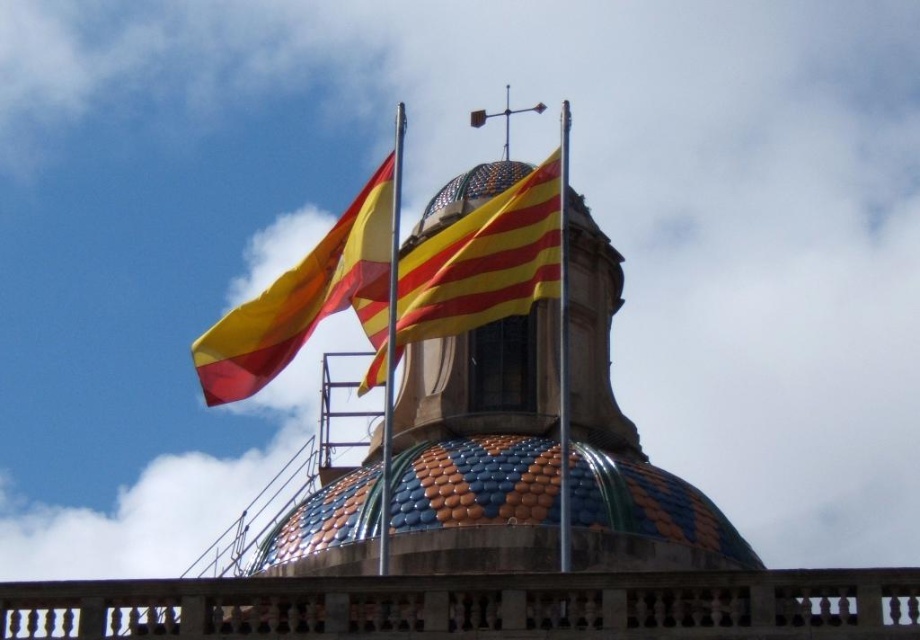
Can you confirm if yellowstriped fabricflag at center is positioned to the left of yellow-red striped fabric flag at upper left?

No, yellowstriped fabricflag at center is not to the left of yellow-red striped fabric flag at upper left.

Measure the distance between yellowstriped fabricflag at center and camera.

The distance of yellowstriped fabricflag at center from camera is 214.96 feet.

Is point (374, 356) farther from camera compared to point (378, 252)?

Yes, it is.

The height and width of the screenshot is (640, 920). Find the location of `yellowstriped fabricflag at center`. yellowstriped fabricflag at center is located at coordinates (480, 266).

From the picture: Is yellowstriped fabricflag at center positioned at the back of metallic pole at center?

Yes, it is.

Can you confirm if yellowstriped fabricflag at center is thinner than metallic pole at center?

Incorrect, yellowstriped fabricflag at center's width is not less than metallic pole at center's.

You are a GUI agent. You are given a task and a screenshot of the screen. Output one action in this format:
    pyautogui.click(x=<x>, y=<y>)
    Task: Click on the yellowstriped fabricflag at center
    The width and height of the screenshot is (920, 640).
    Given the screenshot: What is the action you would take?
    pyautogui.click(x=480, y=266)

The height and width of the screenshot is (640, 920). I want to click on yellowstriped fabricflag at center, so click(480, 266).

Which is behind, point (311, 292) or point (386, 403)?

The point (311, 292) is more distant.

Can you confirm if yellow-red striped fabric flag at upper left is bigger than metallic pole at center?

Correct, yellow-red striped fabric flag at upper left is larger in size than metallic pole at center.

Does point (299, 312) come farther from viewer compared to point (397, 192)?

Yes, it is behind point (397, 192).

The image size is (920, 640). Identify the location of yellow-red striped fabric flag at upper left. (305, 298).